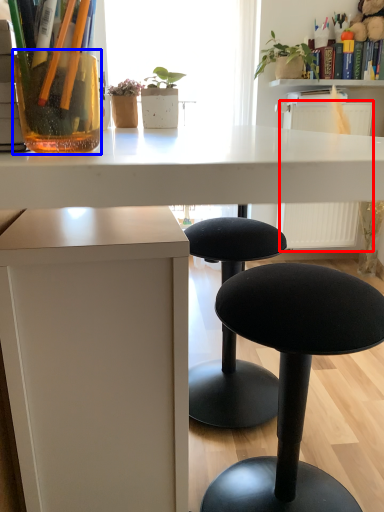
Question: Among these objects, which one is nearest to the camera, radiator (highlighted by a red box) or vase (highlighted by a blue box)?

Choices:
 (A) radiator
 (B) vase

Answer: (B)